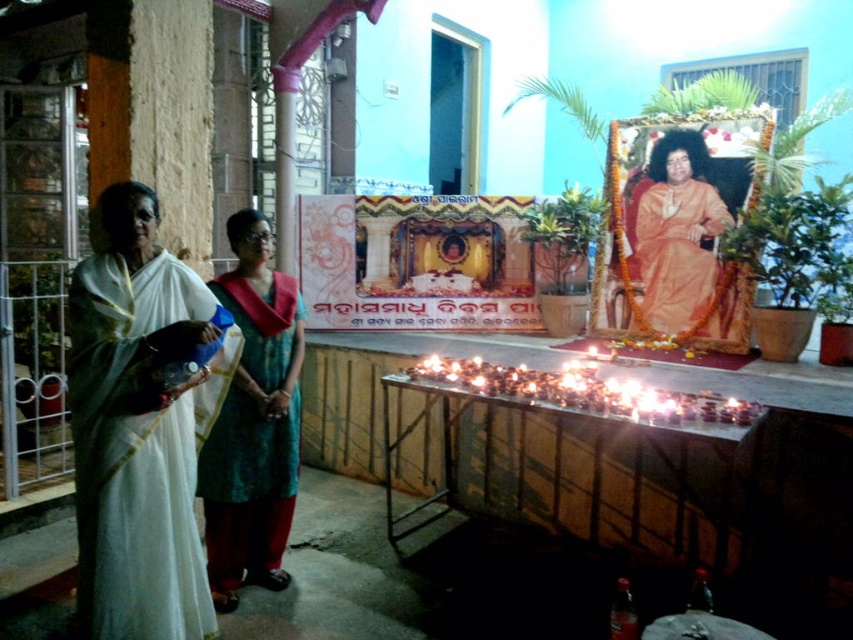
Question: Which point appears farthest from the camera in this image?

Choices:
 (A) (276, 508)
 (B) (637, 324)

Answer: (B)

Question: Does teal silk saree at center have a greater width compared to orange silk saree at center?

Choices:
 (A) yes
 (B) no

Answer: (B)

Question: Can you confirm if white silk saree at left is thinner than orange silk saree at center?

Choices:
 (A) no
 (B) yes

Answer: (B)

Question: Which of these objects is positioned closest to the orange silk saree at center?

Choices:
 (A) teal silk saree at center
 (B) white silk saree at left

Answer: (A)

Question: Considering the relative positions of teal silk saree at center and orange silk saree at center in the image provided, where is teal silk saree at center located with respect to orange silk saree at center?

Choices:
 (A) left
 (B) right

Answer: (A)

Question: Which point is farther to the camera?

Choices:
 (A) orange silk saree at center
 (B) teal silk saree at center

Answer: (A)